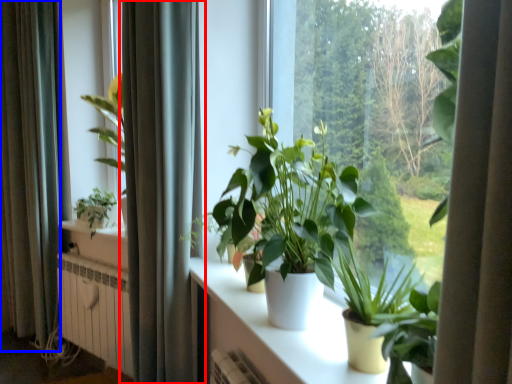
Question: Which of the following is the closest to the observer, curtain (highlighted by a red box) or curtain (highlighted by a blue box)?

Choices:
 (A) curtain
 (B) curtain

Answer: (A)